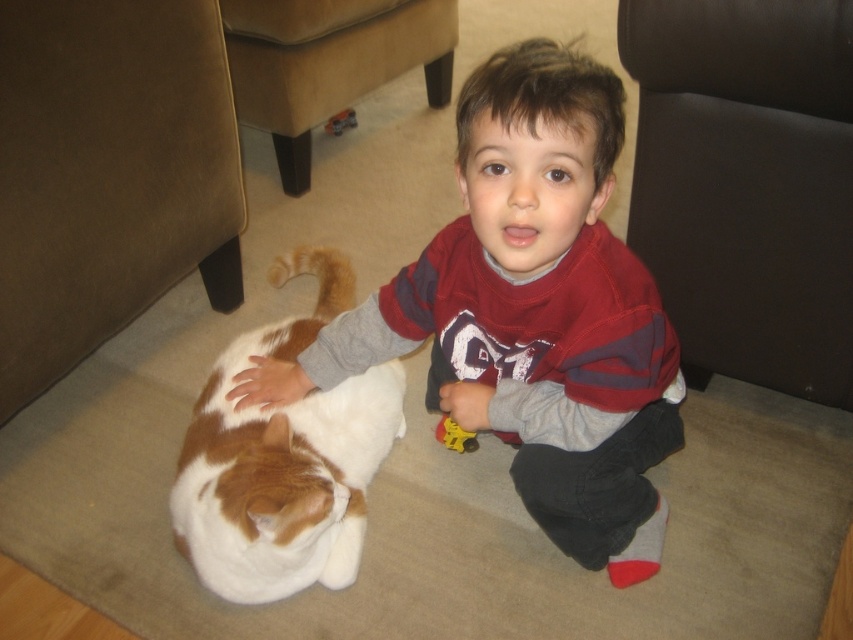
You are a parent trying to ensure your child can safely reach both the white soft fur cat at lower left and the metallic red toy car at center. Given that the child can stretch 1.2 meters, will they be able to reach both items without moving?

The distance between the white soft fur cat at lower left and the metallic red toy car at center is 1.35 meters. Since the child can only stretch 1.2 meters, they cannot reach both items without moving.

You are a parent trying to clean up the room. You see the orange fur tail at lower left and the yellow plastic toy at center. Which item is wider and needs to be moved first to avoid blocking the path?

The orange fur tail at lower left might be wider than yellow plastic toy at center, so it should be moved first to avoid blocking the path.